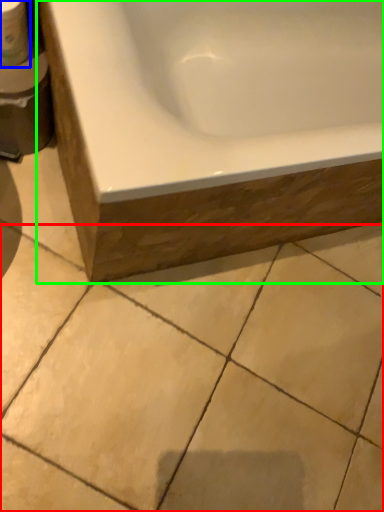
Question: Based on their relative distances, which object is nearer to ceramic tile (highlighted by a red box)? Choose from toilet paper (highlighted by a blue box) and bathtub (highlighted by a green box).

Choices:
 (A) toilet paper
 (B) bathtub

Answer: (B)